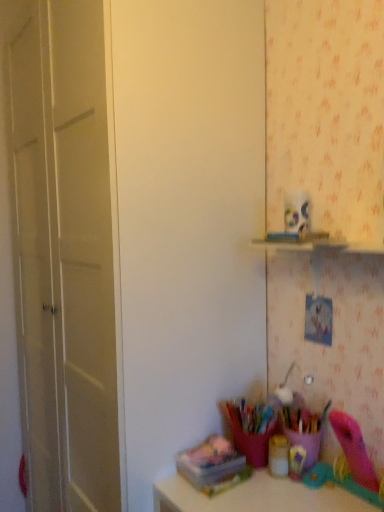
How much space does translucent plastic container at lower center, marked as the first stationery in a left-to-right arrangement, occupy vertically?

translucent plastic container at lower center, marked as the first stationery in a left-to-right arrangement, is 0.78 inches tall.

Consider the image. How much space does translucent plastic container at lower center, the 3th stationery from the right, occupy horizontally?

It is 8.12 inches.

Where is `matte white door at left`? The image size is (384, 512). matte white door at left is located at coordinates (x=187, y=220).

I want to click on translucent plastic container at lower right, the third stationery from the left, so pyautogui.click(x=304, y=428).

Is point (153, 329) more distant than point (297, 416)?

That is False.

Is matte white door at left in contact with translucent plastic container at lower right, which is the first stationery in right-to-left order?

No, matte white door at left is not next to translucent plastic container at lower right, which is the first stationery in right-to-left order.

From the image's perspective, between matte white door at left and translucent plastic container at lower right, which is the first stationery in right-to-left order, who is located below?

From the image's view, translucent plastic container at lower right, which is the first stationery in right-to-left order, is below.

Which is behind, matte white door at left or translucent plastic container at lower right, which is the first stationery in right-to-left order?

translucent plastic container at lower right, which is the first stationery in right-to-left order, is behind.

Can you tell me how much translucent plastic container at lower center, the 3th stationery from the right, and matte white door at left differ in facing direction?

The angle between the facing direction of translucent plastic container at lower center, the 3th stationery from the right, and the facing direction of matte white door at left is 7.65 degrees.

From a real-world perspective, does translucent plastic container at lower center, the 3th stationery from the right, sit lower than matte white door at left?

Yes, from a real-world perspective, translucent plastic container at lower center, the 3th stationery from the right, is under matte white door at left.

Is matte white door at left a part of translucent plastic container at lower center, the 3th stationery from the right?

That's incorrect, matte white door at left is not inside translucent plastic container at lower center, the 3th stationery from the right.

Considering the positions of objects translucent plastic container at lower center, marked as the first stationery in a left-to-right arrangement, and matte white door at left in the image provided, who is more to the left, translucent plastic container at lower center, marked as the first stationery in a left-to-right arrangement, or matte white door at left?

matte white door at left.

Is translucent plastic container at lower right, the third stationery from the left, spatially inside translucent plastic container at lower center, the 3th stationery from the right, or outside of it?

translucent plastic container at lower right, the third stationery from the left, is outside translucent plastic container at lower center, the 3th stationery from the right.

Is translucent plastic container at lower right, the third stationery from the left, oriented towards translucent plastic container at lower center, marked as the first stationery in a left-to-right arrangement?

No.

From the picture: Considering the sizes of objects translucent plastic container at lower right, which is the first stationery in right-to-left order, and translucent plastic container at lower center, marked as the first stationery in a left-to-right arrangement, in the image provided, who is smaller, translucent plastic container at lower right, which is the first stationery in right-to-left order, or translucent plastic container at lower center, marked as the first stationery in a left-to-right arrangement,?

translucent plastic container at lower center, marked as the first stationery in a left-to-right arrangement.

Find the location of `stationery that is the 1st one when counting backward from the translucent plastic container at lower center, marked as the first stationery in a left-to-right arrangement`. stationery that is the 1st one when counting backward from the translucent plastic container at lower center, marked as the first stationery in a left-to-right arrangement is located at coordinates (304, 428).

From a real-world perspective, is matte gold container at lower center, marked as the second stationery in a left-to-right arrangement, beneath matte white door at left?

Indeed, from a real-world perspective, matte gold container at lower center, marked as the second stationery in a left-to-right arrangement, is positioned beneath matte white door at left.

Is matte gold container at lower center, marked as the second stationery in a left-to-right arrangement, smaller than matte white door at left?

Yes, matte gold container at lower center, marked as the second stationery in a left-to-right arrangement, is smaller than matte white door at left.

Is matte gold container at lower center, marked as the second stationery in a left-to-right arrangement, aimed at matte white door at left?

No, matte gold container at lower center, marked as the second stationery in a left-to-right arrangement, is not turned towards matte white door at left.

Considering the sizes of matte gold container at lower center, marked as the second stationery in a left-to-right arrangement, and matte white door at left in the image, is matte gold container at lower center, marked as the second stationery in a left-to-right arrangement, taller or shorter than matte white door at left?

In the image, matte gold container at lower center, marked as the second stationery in a left-to-right arrangement, appears to be shorter than matte white door at left.

Relative to matte gold container at lower center, marked as the second stationery in a left-to-right arrangement, is translucent plastic container at lower center, the 3th stationery from the right, in front or behind?

In the image, translucent plastic container at lower center, the 3th stationery from the right, appears in front of matte gold container at lower center, marked as the second stationery in a left-to-right arrangement.

Can you tell me how much translucent plastic container at lower center, the 3th stationery from the right, and matte gold container at lower center, marked as the second stationery in a left-to-right arrangement, differ in facing direction?

7 degrees.

Would you say translucent plastic container at lower center, the 3th stationery from the right, is inside or outside matte gold container at lower center, the 2th stationery in the right-to-left sequence?

translucent plastic container at lower center, the 3th stationery from the right, cannot be found inside matte gold container at lower center, the 2th stationery in the right-to-left sequence.

From the image's perspective, is translucent plastic container at lower center, the 3th stationery from the right, above matte gold container at lower center, marked as the second stationery in a left-to-right arrangement?

No, from the image's perspective, translucent plastic container at lower center, the 3th stationery from the right, is not on top of matte gold container at lower center, marked as the second stationery in a left-to-right arrangement.

Consider the image. Is matte white door at left far away from translucent plastic container at lower center, the 3th stationery from the right?

No, matte white door at left is in close proximity to translucent plastic container at lower center, the 3th stationery from the right.

Considering the sizes of objects matte white door at left and translucent plastic container at lower center, marked as the first stationery in a left-to-right arrangement, in the image provided, who is wider, matte white door at left or translucent plastic container at lower center, marked as the first stationery in a left-to-right arrangement,?

Wider between the two is matte white door at left.

Is point (215, 88) in front of point (243, 479)?

No, (215, 88) is behind (243, 479).

How far apart are matte white door at left and translucent plastic container at lower center, the 3th stationery from the right?

A: They are 21.26 inches apart.

Does matte white door at left turn towards matte gold container at lower center, marked as the second stationery in a left-to-right arrangement?

No.

Which of these two, matte white door at left or matte gold container at lower center, the 2th stationery in the right-to-left sequence, is thinner?

matte gold container at lower center, the 2th stationery in the right-to-left sequence.

Is matte white door at left positioned beyond the bounds of matte gold container at lower center, marked as the second stationery in a left-to-right arrangement?

Yes, matte white door at left is outside of matte gold container at lower center, marked as the second stationery in a left-to-right arrangement.

Identify the location of the 3rd stationery counting from the right of the matte white door at left. (304, 428).

Locate an element on the screen. The height and width of the screenshot is (512, 384). door that appears in front of the translucent plastic container at lower center, the 3th stationery from the right is located at coordinates (187, 220).

When comparing their distances from translucent plastic container at lower center, marked as the first stationery in a left-to-right arrangement, does matte gold container at lower center, the 2th stationery in the right-to-left sequence, or translucent plastic container at lower right, the third stationery from the left, seem further?

translucent plastic container at lower right, the third stationery from the left.

Based on their spatial positions, is matte gold container at lower center, the 2th stationery in the right-to-left sequence, or matte white door at left further from translucent plastic container at lower center, the 3th stationery from the right?

matte white door at left is positioned further to the anchor translucent plastic container at lower center, the 3th stationery from the right.

Which object lies nearer to the anchor point matte white door at left, translucent plastic container at lower center, the 3th stationery from the right, or matte gold container at lower center, marked as the second stationery in a left-to-right arrangement?

translucent plastic container at lower center, the 3th stationery from the right, is closer to matte white door at left.

Considering their positions, is matte white door at left positioned further to translucent plastic container at lower right, which is the first stationery in right-to-left order, than translucent plastic container at lower center, the 3th stationery from the right?

matte white door at left is positioned further to the anchor translucent plastic container at lower right, which is the first stationery in right-to-left order.

Which object lies further to the anchor point matte gold container at lower center, marked as the second stationery in a left-to-right arrangement, matte white door at left or translucent plastic container at lower center, the 3th stationery from the right?

matte white door at left is further to matte gold container at lower center, marked as the second stationery in a left-to-right arrangement.

From the image, which object appears to be farther from translucent plastic container at lower center, marked as the first stationery in a left-to-right arrangement, translucent plastic container at lower right, the third stationery from the left, or matte gold container at lower center, marked as the second stationery in a left-to-right arrangement?

The object further to translucent plastic container at lower center, marked as the first stationery in a left-to-right arrangement, is translucent plastic container at lower right, the third stationery from the left.

Looking at the image, which one is located further to matte gold container at lower center, the 2th stationery in the right-to-left sequence, matte white door at left or translucent plastic container at lower right, the third stationery from the left?

matte white door at left lies further to matte gold container at lower center, the 2th stationery in the right-to-left sequence, than the other object.

From the picture: When comparing their distances from translucent plastic container at lower center, the 3th stationery from the right, does matte white door at left or translucent plastic container at lower right, which is the first stationery in right-to-left order, seem further?

Based on the image, matte white door at left appears to be further to translucent plastic container at lower center, the 3th stationery from the right.

I want to click on stationery situated between translucent plastic container at lower center, the 3th stationery from the right, and translucent plastic container at lower right, which is the first stationery in right-to-left order, from left to right, so click(x=278, y=456).

Find the location of a particular element. Image resolution: width=384 pixels, height=512 pixels. stationery between matte white door at left and matte gold container at lower center, the 2th stationery in the right-to-left sequence, in the horizontal direction is located at coordinates (213, 465).